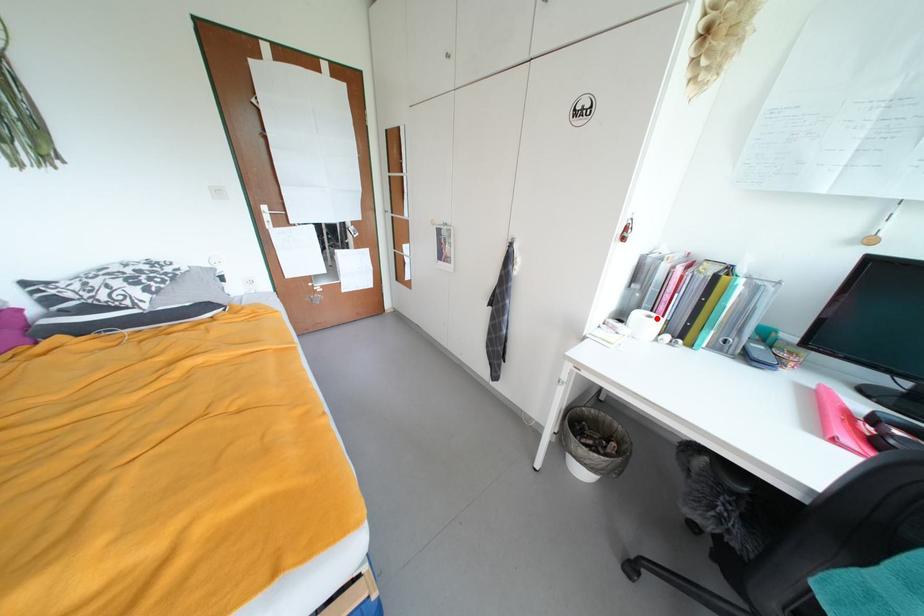
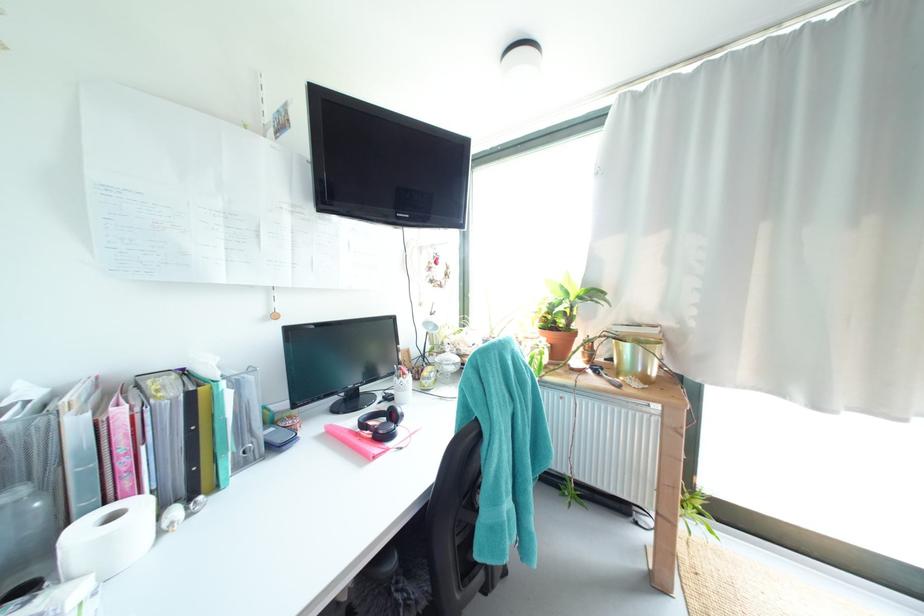
The point at the highlighted location is marked in the first image. Where is the corresponding point in the second image?

(120, 517)